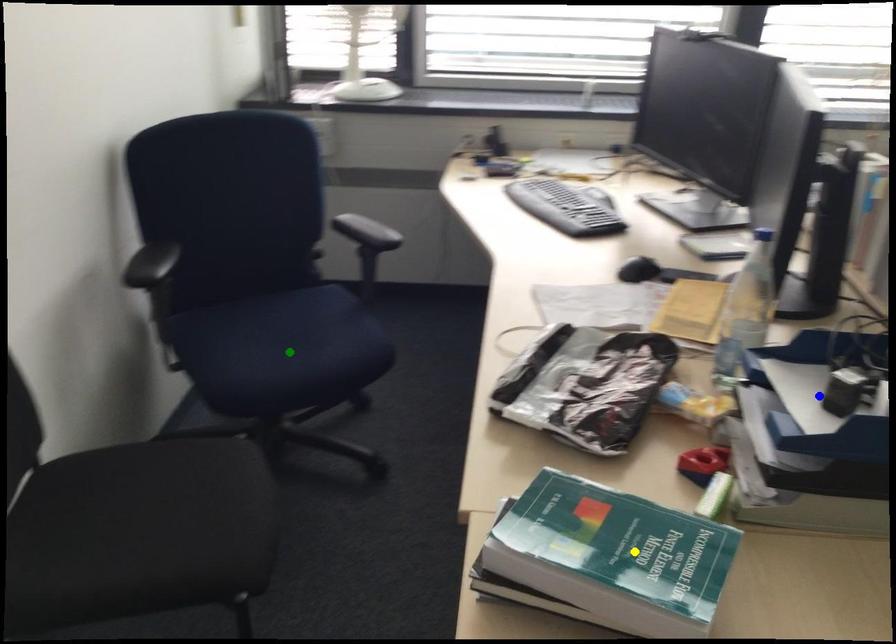
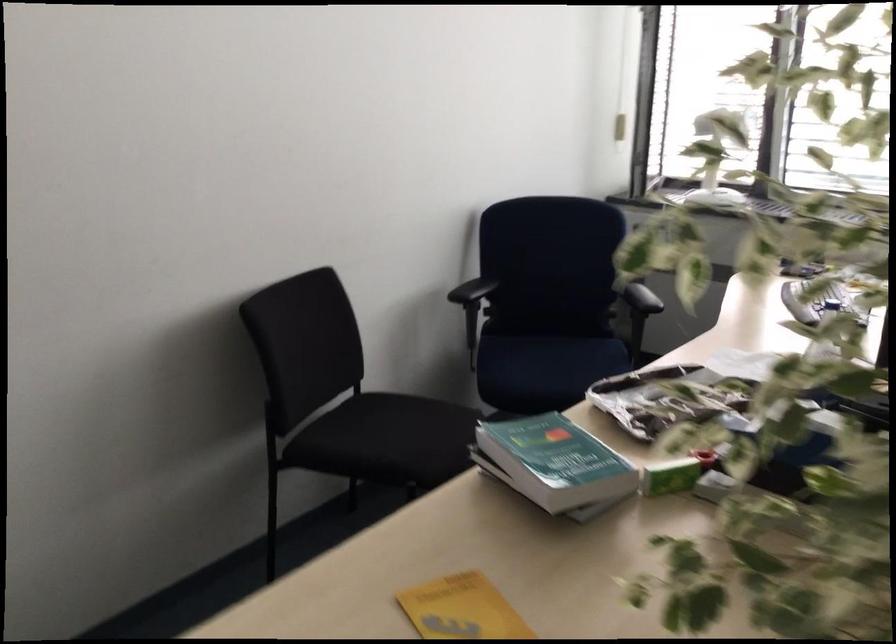
I am providing you with two images of the same scene from different viewpoints. Three points are marked in image1. Which point corresponds to a part or object that is occluded in image2?In image1, three points are marked. Which of them correspond to a part or object that is occluded in image2?Among the three points shown in image1, which one corresponds to a part or object that is no longer visible due to occlusion in image2?

Invisible in image2: blue point.